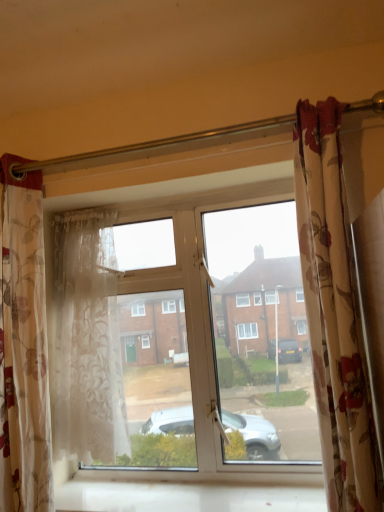
Question: Considering the relative sizes of white smooth window sill at lower center and floral fabric curtain at right, acting as the third curtain starting from the left, in the image provided, is white smooth window sill at lower center bigger than floral fabric curtain at right, acting as the third curtain starting from the left,?

Choices:
 (A) no
 (B) yes

Answer: (A)

Question: Does white smooth window sill at lower center lie in front of floral fabric curtain at right, the first curtain viewed from the right?

Choices:
 (A) yes
 (B) no

Answer: (B)

Question: Considering the relative sizes of white smooth window sill at lower center and floral fabric curtain at right, acting as the third curtain starting from the left, in the image provided, is white smooth window sill at lower center smaller than floral fabric curtain at right, acting as the third curtain starting from the left,?

Choices:
 (A) yes
 (B) no

Answer: (A)

Question: Is white smooth window sill at lower center behind floral fabric curtain at right, acting as the third curtain starting from the left?

Choices:
 (A) no
 (B) yes

Answer: (B)

Question: From the image's perspective, would you say white smooth window sill at lower center is positioned over floral fabric curtain at right, the first curtain viewed from the right?

Choices:
 (A) yes
 (B) no

Answer: (B)

Question: Is white smooth window sill at lower center to the right of floral fabric curtain at right, acting as the third curtain starting from the left, from the viewer's perspective?

Choices:
 (A) yes
 (B) no

Answer: (B)

Question: Does sheer floral fabric curtain at left, which ranks as the second curtain in left-to-right order, appear on the right side of floral fabric curtain at right, acting as the third curtain starting from the left?

Choices:
 (A) no
 (B) yes

Answer: (A)

Question: Is sheer floral fabric curtain at left, which ranks as the second curtain in left-to-right order, oriented away from floral fabric curtain at right, acting as the third curtain starting from the left?

Choices:
 (A) no
 (B) yes

Answer: (A)

Question: Is sheer floral fabric curtain at left, which is the second curtain in right-to-left order, positioned far away from floral fabric curtain at right, acting as the third curtain starting from the left?

Choices:
 (A) yes
 (B) no

Answer: (B)

Question: Does sheer floral fabric curtain at left, which is the second curtain in right-to-left order, have a lesser height compared to floral fabric curtain at right, acting as the third curtain starting from the left?

Choices:
 (A) yes
 (B) no

Answer: (A)

Question: Is sheer floral fabric curtain at left, which is the second curtain in right-to-left order, closer to camera compared to floral fabric curtain at right, acting as the third curtain starting from the left?

Choices:
 (A) no
 (B) yes

Answer: (A)

Question: Can you confirm if sheer floral fabric curtain at left, which ranks as the second curtain in left-to-right order, is positioned to the left of floral fabric curtain at right, the first curtain viewed from the right?

Choices:
 (A) yes
 (B) no

Answer: (A)

Question: Does sheer floral fabric curtain at left, which is the second curtain in right-to-left order, have a greater height compared to translucent floral fabric curtain at left, acting as the first curtain starting from the left?

Choices:
 (A) no
 (B) yes

Answer: (A)